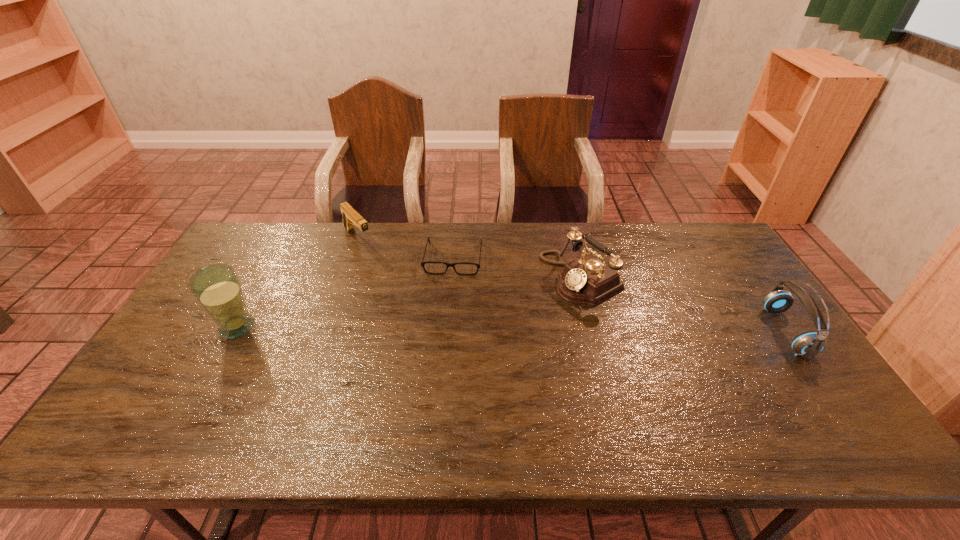
Locate an element on the screen. The image size is (960, 540). vacant space on the desktop that is between the glass and the headset and is positioned on the front-facing side of the spectacles is located at coordinates (443, 329).

This screenshot has width=960, height=540. Identify the location of vacant space on the desktop that is between the glass and the rightmost object and is positioned at the barrel of the second object from left to right. (444, 329).

Locate an element on the screen. This screenshot has width=960, height=540. vacant spot on the desktop that is between the leftmost object and the rightmost object and is positioned on the dial of the fourth object from left to right is located at coordinates (481, 329).